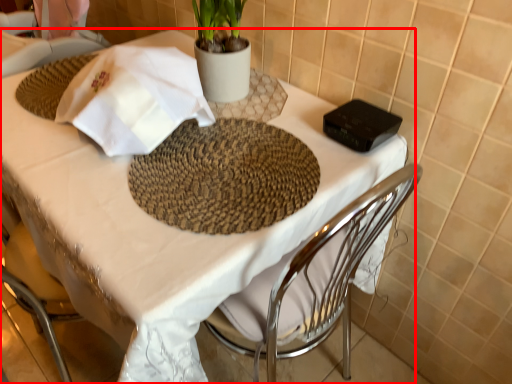
Question: From the image's perspective, considering the relative positions of table (annotated by the red box) and cloth in the image provided, where is table (annotated by the red box) located with respect to the staircase?

Choices:
 (A) below
 (B) above

Answer: (A)